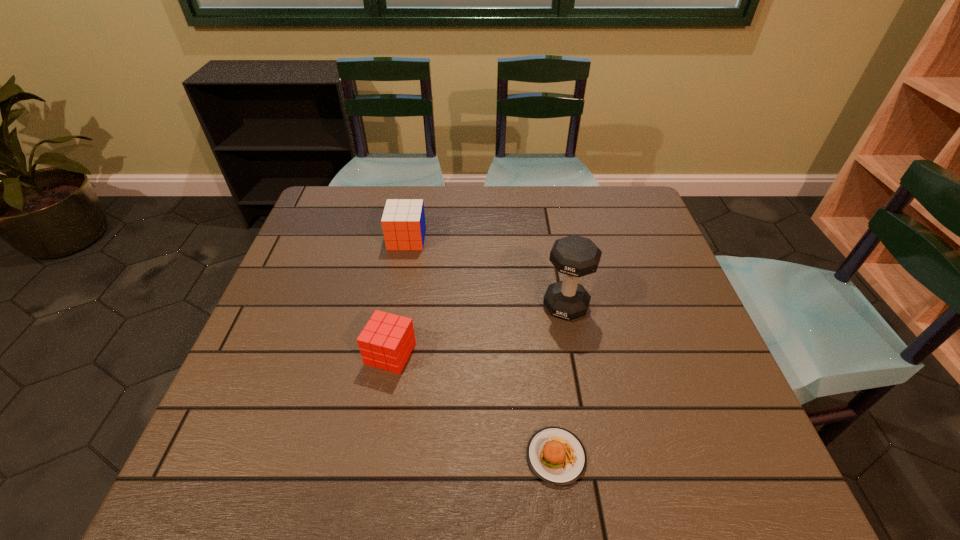
Locate an element on the screen. free spot located on the back of the third farthest object is located at coordinates (401, 292).

Identify the location of blank area located on the back of the food. The height and width of the screenshot is (540, 960). (550, 406).

Identify the location of object situated at the far edge. (403, 222).

The image size is (960, 540). Find the location of `object that is at the near edge`. object that is at the near edge is located at coordinates (557, 456).

The image size is (960, 540). In the image, there is a desktop. What are the coordinates of `vacant region at the far edge` in the screenshot? It's located at (458, 222).

Find the location of `vacant space at the near edge of the desktop`. vacant space at the near edge of the desktop is located at coordinates (584, 487).

Locate an element on the screen. The width and height of the screenshot is (960, 540). vacant area at the left edge of the desktop is located at coordinates (337, 254).

In the image, there is a desktop. Where is `blank space at the right edge`? The width and height of the screenshot is (960, 540). blank space at the right edge is located at coordinates (638, 261).

The height and width of the screenshot is (540, 960). What are the coordinates of `vacant space at the far right corner of the desktop` in the screenshot? It's located at (596, 191).

At what (x,y) coordinates should I click in order to perform the action: click on vacant space at the near right corner. Please return your answer as a coordinate pair (x, y). This screenshot has height=540, width=960. Looking at the image, I should click on (713, 468).